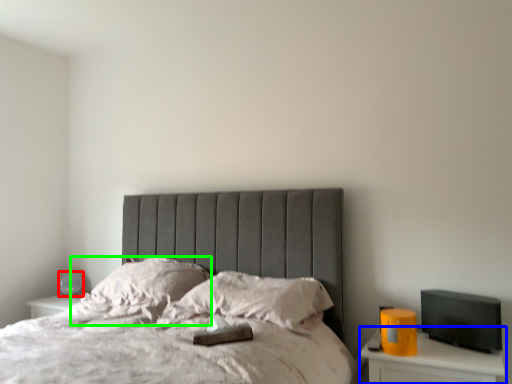
Question: Which object is the closest to the table lamp (highlighted by a red box)? Choose among these: nightstand (highlighted by a blue box) or pillow (highlighted by a green box).

Choices:
 (A) nightstand
 (B) pillow

Answer: (B)